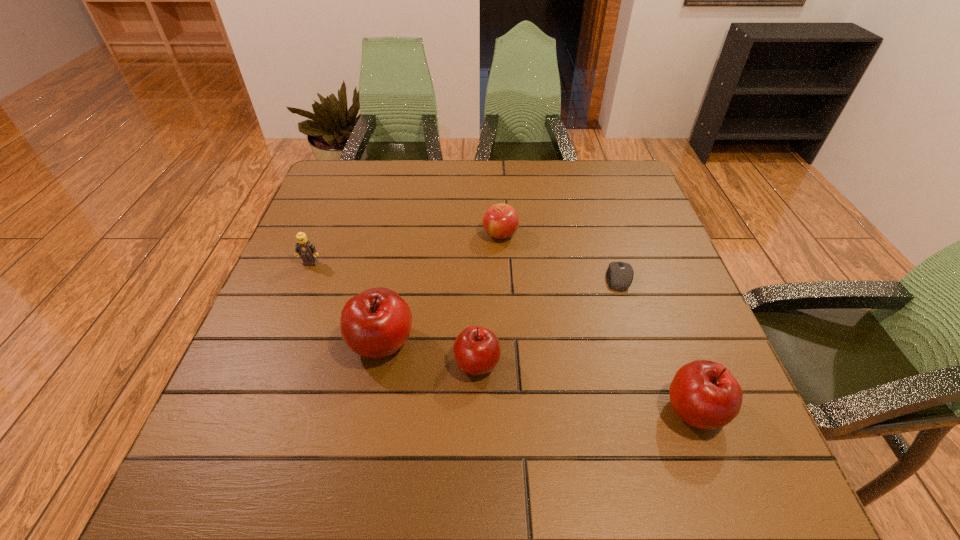
Locate an element on the screen. This screenshot has height=540, width=960. empty space between the tallest object and the third tallest apple is located at coordinates (429, 353).

In order to click on free space between the Lego and the shortest object in this screenshot , I will do `click(465, 270)`.

Find the location of a particular element. The image size is (960, 540). free space between the leftmost object and the rightmost apple is located at coordinates (502, 336).

What are the coordinates of `free space that is in between the shortest apple and the leftmost object` in the screenshot? It's located at [405, 248].

The image size is (960, 540). Find the location of `unoccupied area between the leftmost apple and the computer equipment`. unoccupied area between the leftmost apple and the computer equipment is located at coordinates (500, 310).

Find the location of a particular element. vacant point located between the computer equipment and the leftmost object is located at coordinates (465, 270).

This screenshot has width=960, height=540. In order to click on free point between the second tallest object and the farthest object in this screenshot , I will do `click(597, 322)`.

Identify the location of object that is the fifth closest one to the farthest object. (704, 394).

Locate an element on the screen. The image size is (960, 540). the fourth closest object to the leftmost object is located at coordinates (619, 276).

In order to click on apple that is the closest to the leftmost object in this screenshot , I will do `click(375, 323)`.